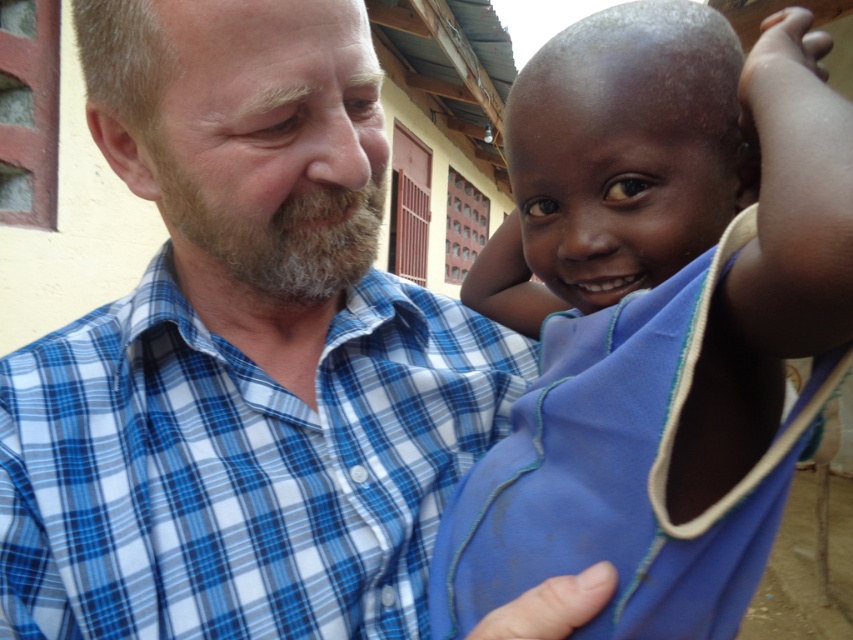
You are designing a costume for a play and need to choose between the blue fabric at right and the blue plaid shirt at center. Which material would be more suitable for a flowing, wide sleeve design?

The blue plaid shirt at center is thicker than the blue fabric at right, so it would be more suitable for a flowing, wide sleeve design because thicker materials hold their shape better when creating voluminous designs.

You are a photographer who wants to ensure that both the blue fabric at right and the blue plaid shirt at center are clearly visible in the photo. Based on their positions, which object should you focus on first to ensure depth of field captures both?

The blue fabric at right is located above the blue plaid shirt at center. To ensure both are in focus, you should focus on the blue plaid shirt at center first since it is closer to the camera, as focusing on the closer object allows the depth of field to extend backward to the farther object.